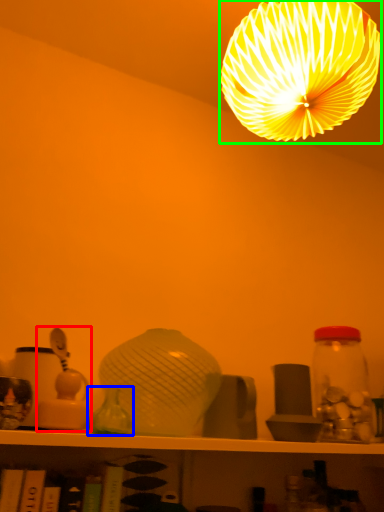
Question: Which object is positioned farthest from toy (highlighted by a red box)? Select from glass vase (highlighted by a blue box) and lamp (highlighted by a green box).

Choices:
 (A) glass vase
 (B) lamp

Answer: (B)